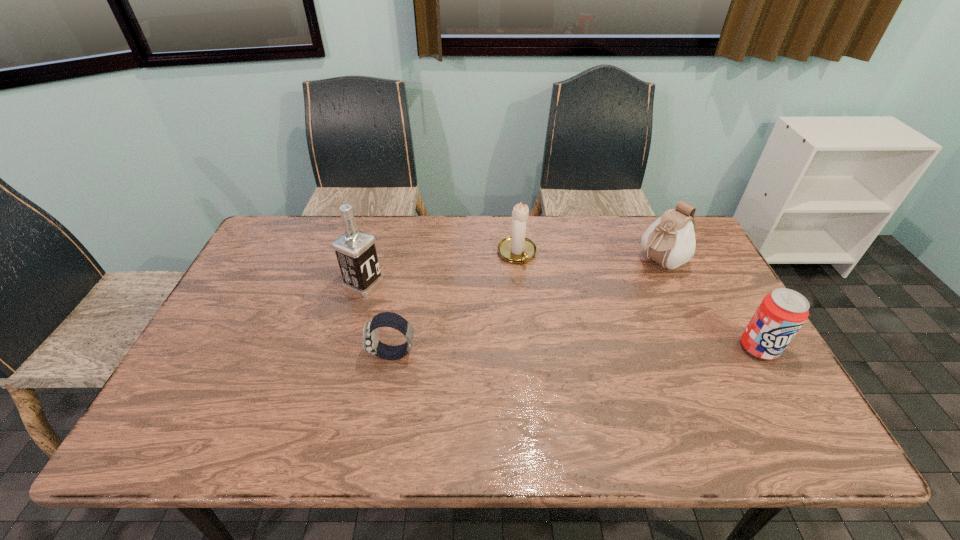
Locate an element on the screen. The image size is (960, 540). pouch at the far edge is located at coordinates (670, 241).

Locate an element on the screen. Image resolution: width=960 pixels, height=540 pixels. candle holder at the far edge is located at coordinates point(517,248).

This screenshot has width=960, height=540. Identify the location of soda can present at the right edge. (781, 314).

The image size is (960, 540). I want to click on pouch at the right edge, so click(x=670, y=241).

The width and height of the screenshot is (960, 540). I want to click on object at the far right corner, so click(x=670, y=241).

Where is `free region at the far edge of the desktop`? The image size is (960, 540). free region at the far edge of the desktop is located at coordinates [x=328, y=245].

The image size is (960, 540). In the image, there is a desktop. In order to click on free space at the near edge in this screenshot , I will do `click(437, 384)`.

I want to click on free space at the left edge of the desktop, so pos(223,366).

Where is `free space at the far right corner`? The image size is (960, 540). free space at the far right corner is located at coordinates (640, 221).

Find the location of a particular element. This screenshot has width=960, height=540. vacant region between the candle holder and the second object from right to left is located at coordinates (588, 258).